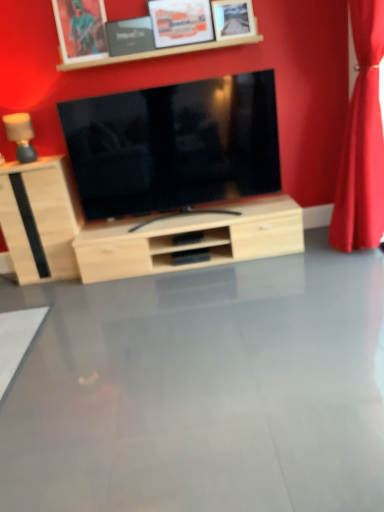
The width and height of the screenshot is (384, 512). I want to click on vacant region to the left of red velvet curtain at right, so click(320, 261).